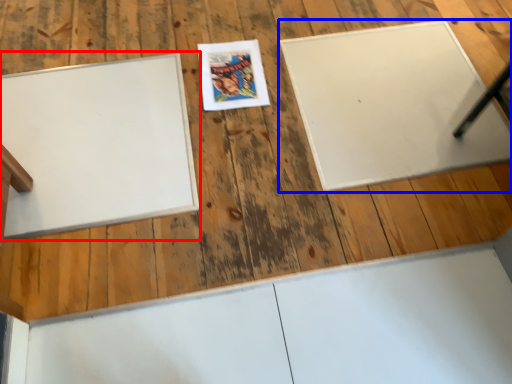
Question: Which object appears farthest to the camera in this image, bulletin board (highlighted by a red box) or bulletin board (highlighted by a blue box)?

Choices:
 (A) bulletin board
 (B) bulletin board

Answer: (B)